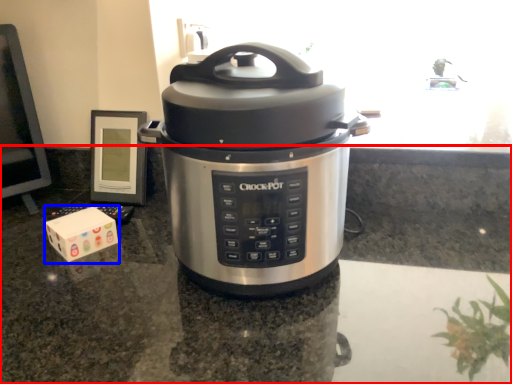
Question: Which of the following is the closest to the observer, counter top (highlighted by a red box) or block (highlighted by a blue box)?

Choices:
 (A) counter top
 (B) block

Answer: (A)